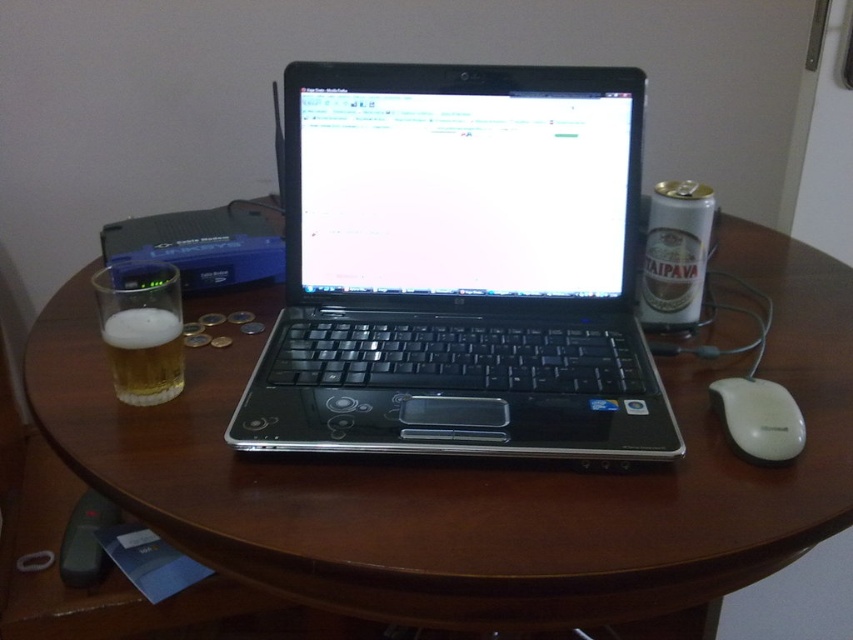
You are a delivery robot with a 6 inch wide package. You need to place the package on the table between the brown wood round table at center and the black plastic laptop at center. Is there enough space?

The brown wood round table at center and black plastic laptop at center are 5.56 inches apart from each other. Since the package is 6 inches wide, there isn not enough space to place it between them.

You are organizing items on the brown wood round table at center and the white plastic mouse at right. Based on their positions, which object is closer to the edge of the table?

The white plastic mouse at right is closer to the edge of the table because it is positioned below the brown wood round table at center, which is above it.

You are sitting at the brown wood round table at center and want to reach the white plastic mouse at right. Is the mouse easy to reach from your current position?

The white plastic mouse at right is further away from you than the brown wood round table at center, so it may require stretching or moving closer to reach.